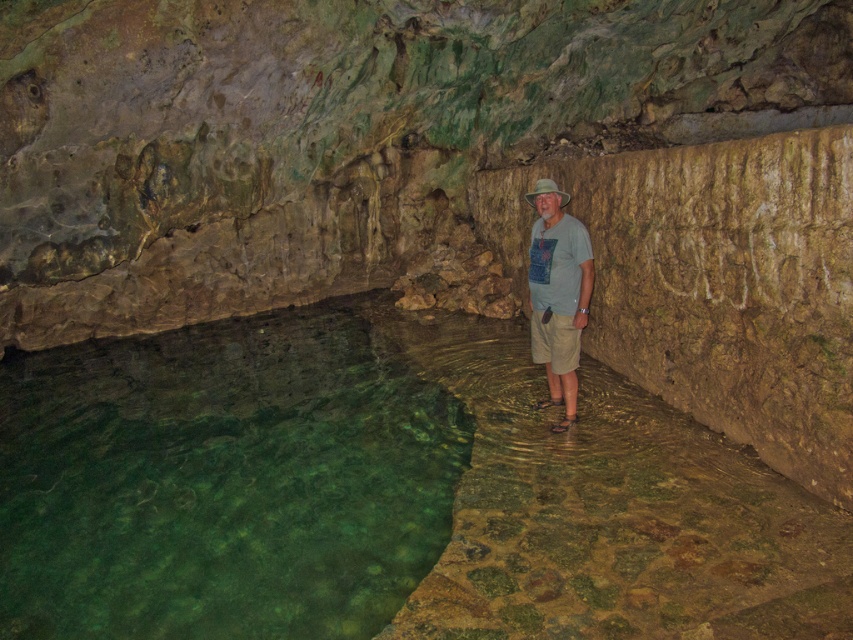
You are navigating through the cave and need to cross the green translucent water at lower left. Based on its position, is it closer to the left edge or the right edge of the scene?

The green translucent water at lower left is located at point 0.752 on the x and 0.261 on the y, so it is closer to the right edge of the scene since the x coordinate is 0.752, which is closer to 1.0 than 0.0.

You are standing in the cave and want to cross to the other side. There is a point marked at coordinates (222, 481) which is green translucent water at lower left. Can you safely step on this point to cross?

The point at (222, 481) is green translucent water at lower left, so stepping on it would not be safe as it is water.